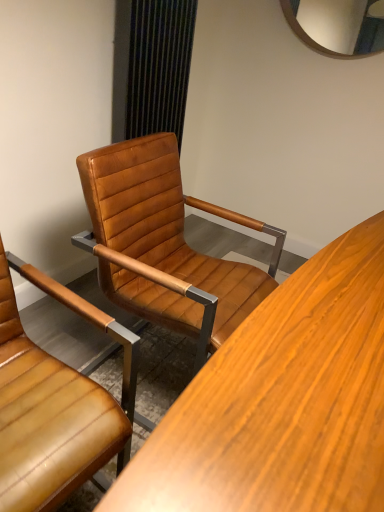
Question: From the image's perspective, is leather at center, which ranks as the 1th chair in right-to-left order, beneath leather at center, the second chair in the right-to-left sequence?

Choices:
 (A) no
 (B) yes

Answer: (A)

Question: Does leather at center, which ranks as the 1th chair in right-to-left order, lie in front of leather at center, the first chair from the left?

Choices:
 (A) yes
 (B) no

Answer: (B)

Question: Is leather at center, which ranks as the 1th chair in right-to-left order, shorter than leather at center, the first chair from the left?

Choices:
 (A) no
 (B) yes

Answer: (A)

Question: From the image's perspective, does leather at center, which ranks as the second chair in left-to-right order, appear higher than leather at center, the second chair in the right-to-left sequence?

Choices:
 (A) no
 (B) yes

Answer: (B)

Question: Does leather at center, which ranks as the second chair in left-to-right order, appear on the left side of leather at center, the first chair from the left?

Choices:
 (A) yes
 (B) no

Answer: (B)

Question: Is leather at center, which ranks as the second chair in left-to-right order, touching leather at center, the second chair in the right-to-left sequence?

Choices:
 (A) yes
 (B) no

Answer: (B)

Question: Is leather at center, the first chair from the left, smaller than black textured curtain at upper center?

Choices:
 (A) no
 (B) yes

Answer: (A)

Question: Could you tell me if leather at center, the first chair from the left, is facing black textured curtain at upper center?

Choices:
 (A) yes
 (B) no

Answer: (B)

Question: Considering the relative sizes of leather at center, the second chair in the right-to-left sequence, and black textured curtain at upper center in the image provided, is leather at center, the second chair in the right-to-left sequence, wider than black textured curtain at upper center?

Choices:
 (A) yes
 (B) no

Answer: (A)

Question: Can you confirm if leather at center, the second chair in the right-to-left sequence, is positioned to the left of black textured curtain at upper center?

Choices:
 (A) no
 (B) yes

Answer: (B)

Question: Is leather at center, the first chair from the left, shorter than black textured curtain at upper center?

Choices:
 (A) yes
 (B) no

Answer: (A)

Question: Would you consider leather at center, the second chair in the right-to-left sequence, to be distant from black textured curtain at upper center?

Choices:
 (A) yes
 (B) no

Answer: (A)

Question: From a real-world perspective, is black textured curtain at upper center physically above leather at center, the second chair in the right-to-left sequence?

Choices:
 (A) yes
 (B) no

Answer: (A)